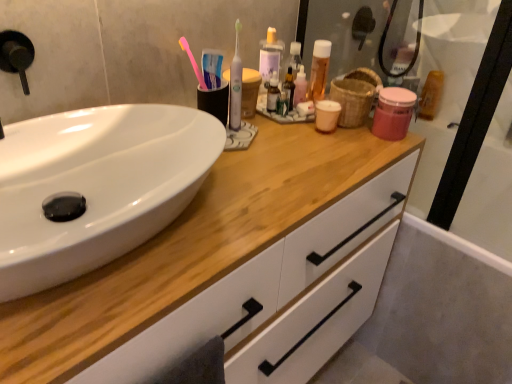
Where is `free spot to the right of white glossy sink at left`? free spot to the right of white glossy sink at left is located at coordinates (286, 187).